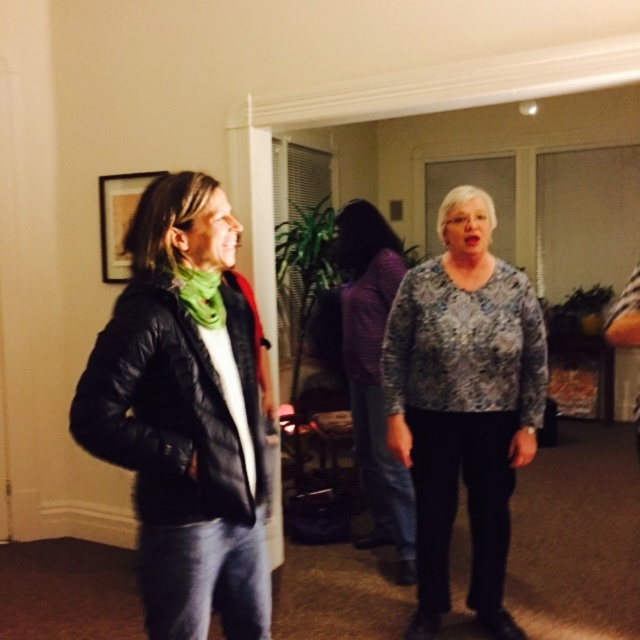
Question: Where is black quilted jacket at left located in relation to printed fabric blouse at center in the image?

Choices:
 (A) left
 (B) right

Answer: (A)

Question: Which point is farther to the camera?

Choices:
 (A) printed fabric blouse at center
 (B) black quilted jacket at left

Answer: (A)

Question: Is the position of black quilted jacket at left less distant than that of printed fabric blouse at center?

Choices:
 (A) no
 (B) yes

Answer: (B)

Question: Is black quilted jacket at left to the right of printed fabric blouse at center from the viewer's perspective?

Choices:
 (A) no
 (B) yes

Answer: (A)